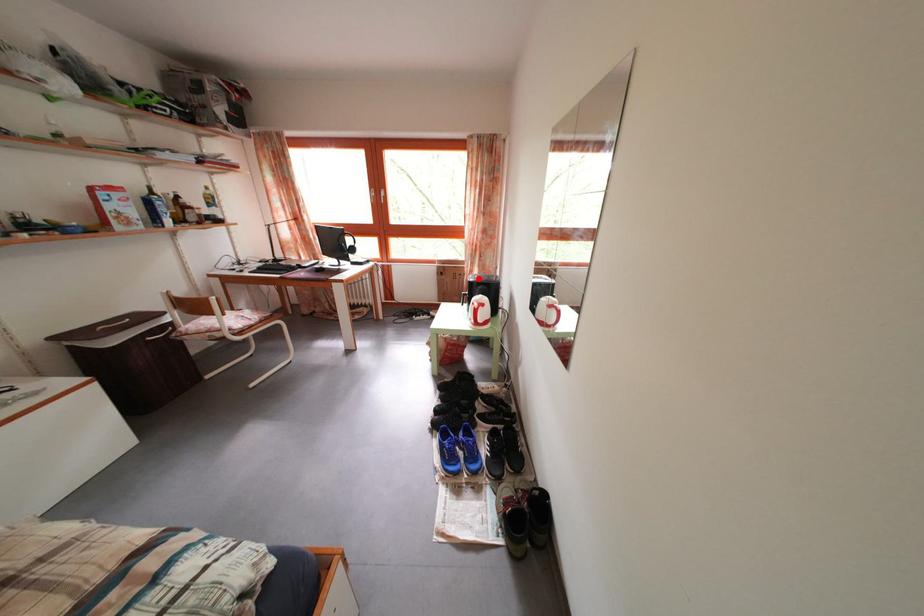
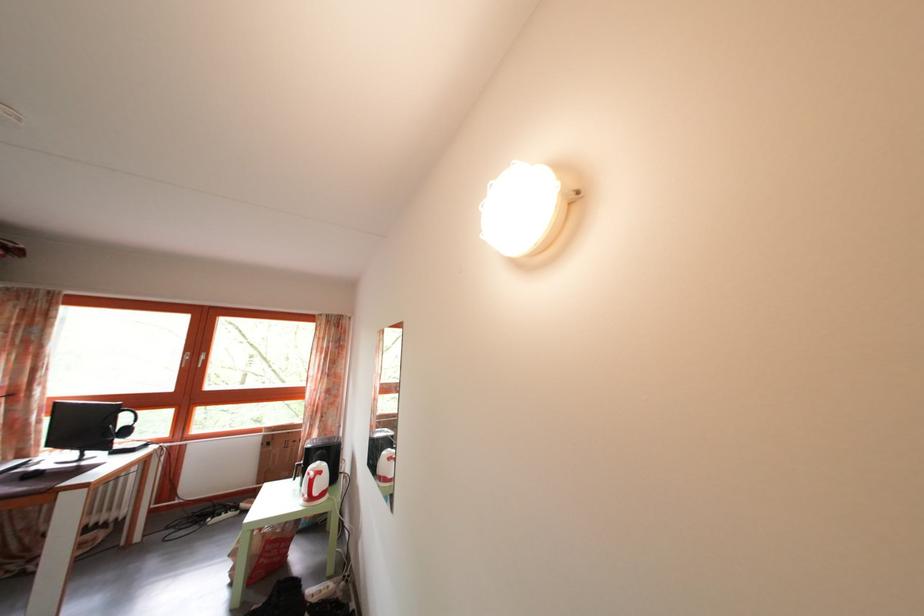
In the second image, find the point that corresponds to the highlighted location in the first image.

(317, 442)